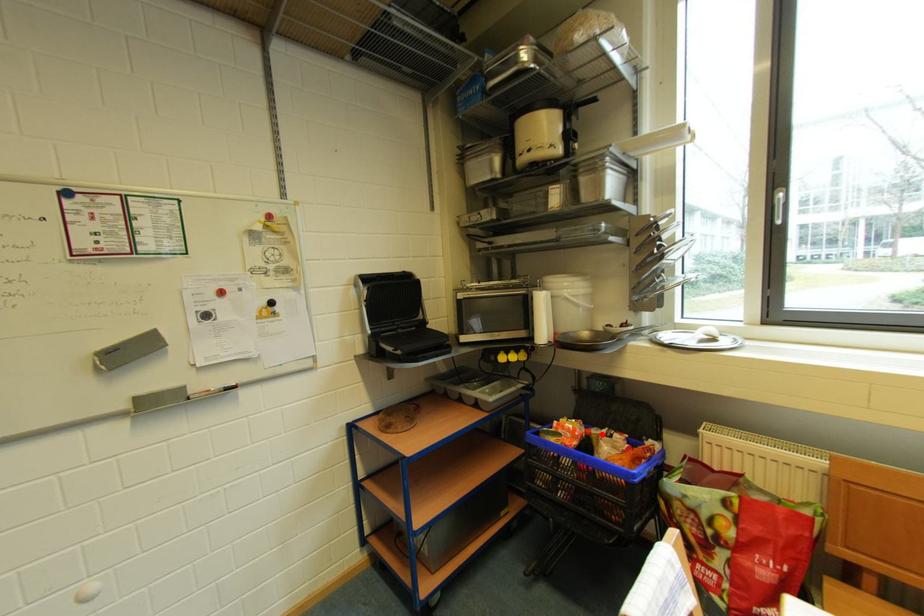
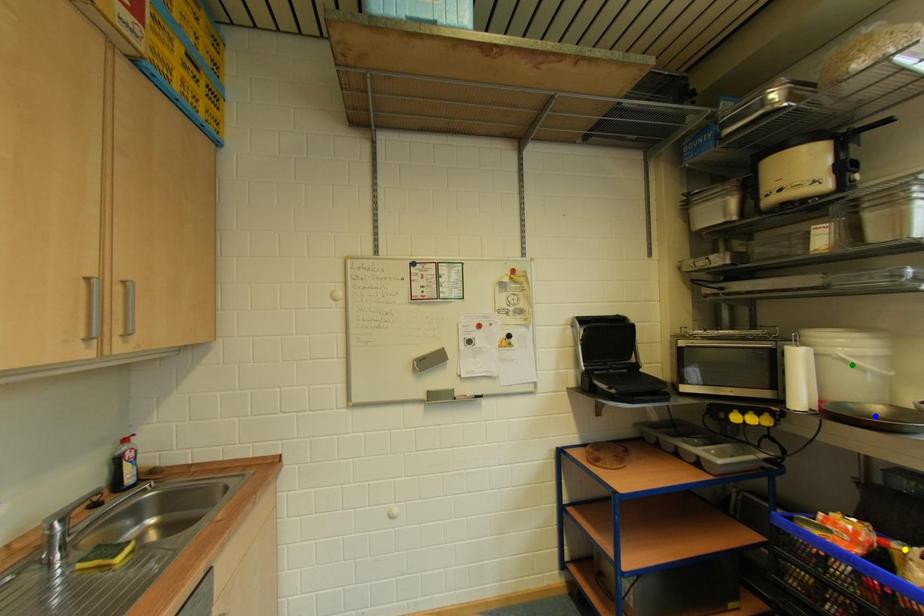
Question: I am providing you with two images of the same scene from different viewpoints. A red point is marked on the first image. You are given multiple points on the second image. In image 2, which mark is for the same physical point as the one in image 1?

Choices:
 (A) yellow point
 (B) blue point
 (C) green point

Answer: (A)